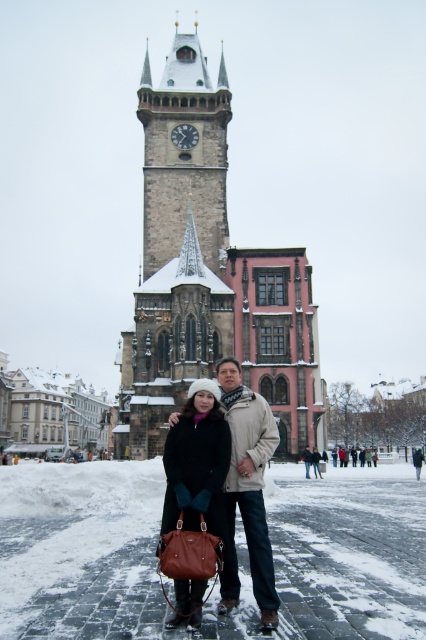
Which is more to the right, white powdery snow at center or beige wool scarf at center?

Positioned to the right is beige wool scarf at center.

Does white powdery snow at center have a greater width compared to beige wool scarf at center?

Indeed, white powdery snow at center has a greater width compared to beige wool scarf at center.

At what (x,y) coordinates should I click in order to perform the action: click on white powdery snow at center. Please return your answer as a coordinate pair (x, y). The width and height of the screenshot is (426, 640). Looking at the image, I should click on (236, 550).

Find the location of a particular element. The width and height of the screenshot is (426, 640). white powdery snow at center is located at coordinates (236, 550).

Who is shorter, white powdery snow at center or matte black coat at center?

white powdery snow at center

Is point (339, 589) behind point (253, 573)?

Yes, point (339, 589) is farther from viewer.

Locate an element on the screen. This screenshot has width=426, height=640. white powdery snow at center is located at coordinates (236, 550).

Is point (229, 540) behind point (305, 472)?

No, (229, 540) is in front of (305, 472).

Between matte black coat at center and beige wool scarf at center, which one is positioned higher?

matte black coat at center is above.

Between point (267, 598) and point (307, 458), which one is positioned behind?

Point (307, 458)

What are the coordinates of `matte black coat at center` in the screenshot? It's located at (247, 490).